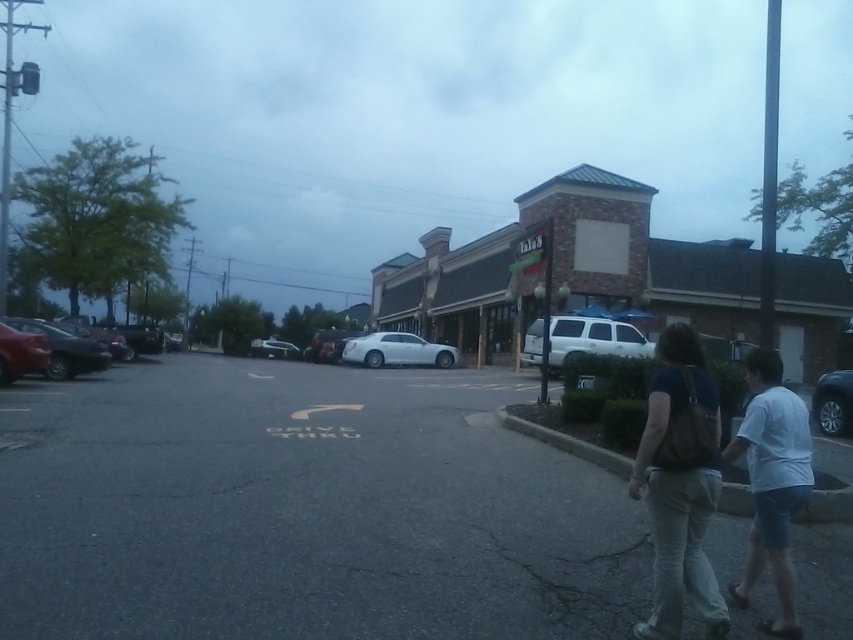
Question: Which object is farther from the camera taking this photo?

Choices:
 (A) shiny silver sedan at left
 (B) shiny red sedan at left

Answer: (A)

Question: Which point is closer to the camera?

Choices:
 (A) white matte suv at center
 (B) matte black car at left

Answer: (B)

Question: Which point is closer to the camera?

Choices:
 (A) (763, 451)
 (B) (758, 552)
 (C) (73, 364)

Answer: (A)

Question: Does white cotton shirt at lower right appear on the left side of white glossy sedan at center?

Choices:
 (A) yes
 (B) no

Answer: (B)

Question: Is white glossy sedan at center positioned before metallic silver sedan at drive-thru?

Choices:
 (A) no
 (B) yes

Answer: (B)

Question: Can you confirm if satin black car at right is positioned above shiny black sedan at left?

Choices:
 (A) yes
 (B) no

Answer: (B)